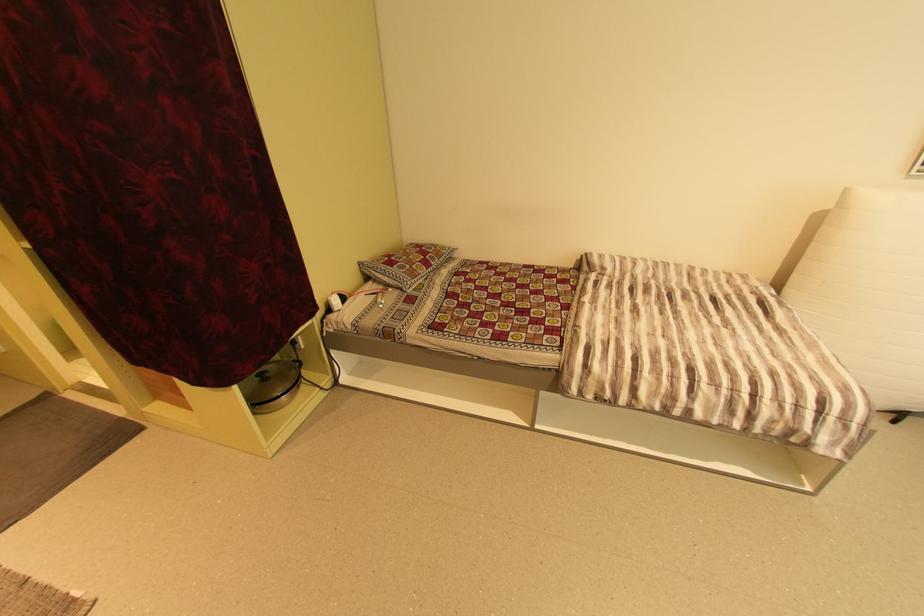
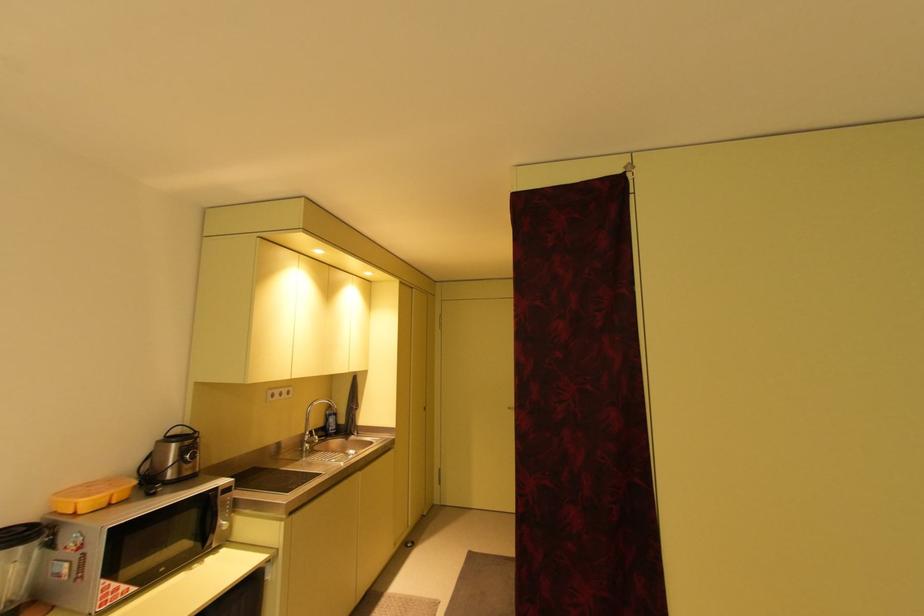
Question: The images are taken continuously from a first-person perspective. In which direction is your viewpoint rotating?

Choices:
 (A) Left
 (B) Right
 (C) Up
 (D) Down

Answer: (A)